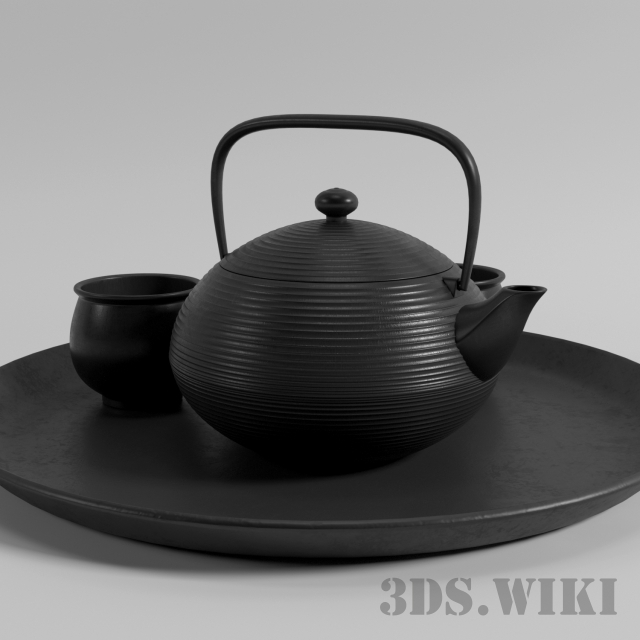
Identify the location of plate. This screenshot has width=640, height=640. (401, 500).